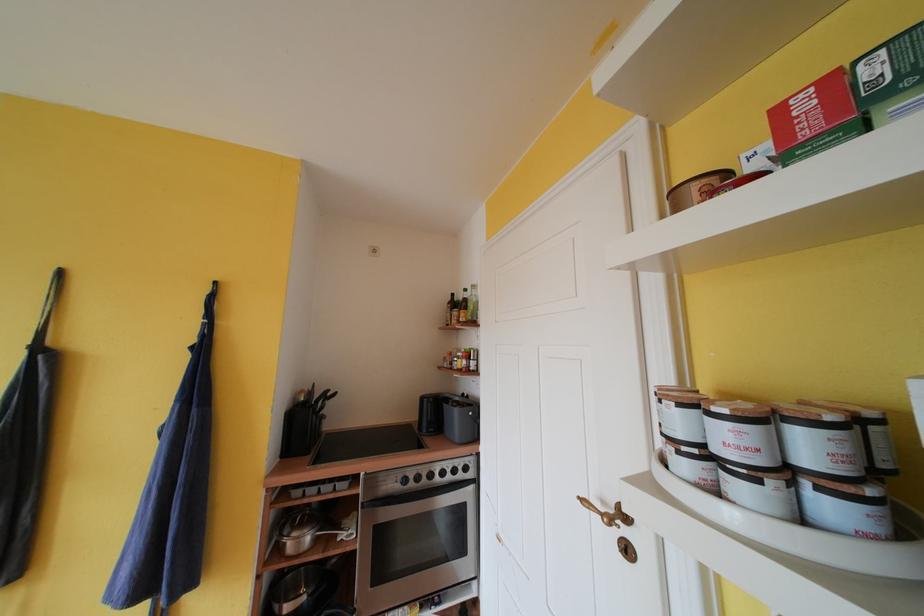
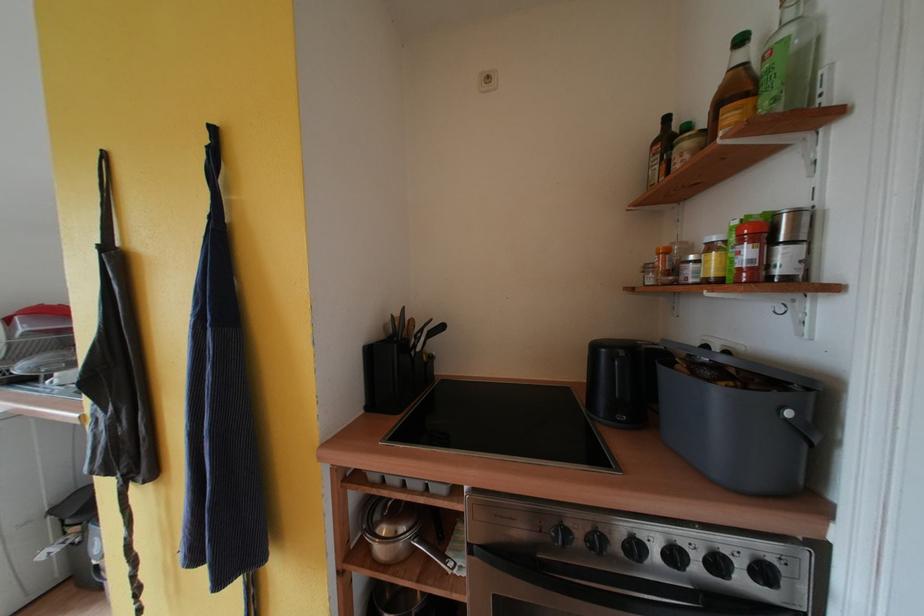
Where in the second image is the point corresponding to point 293,535 from the first image?

(383, 521)